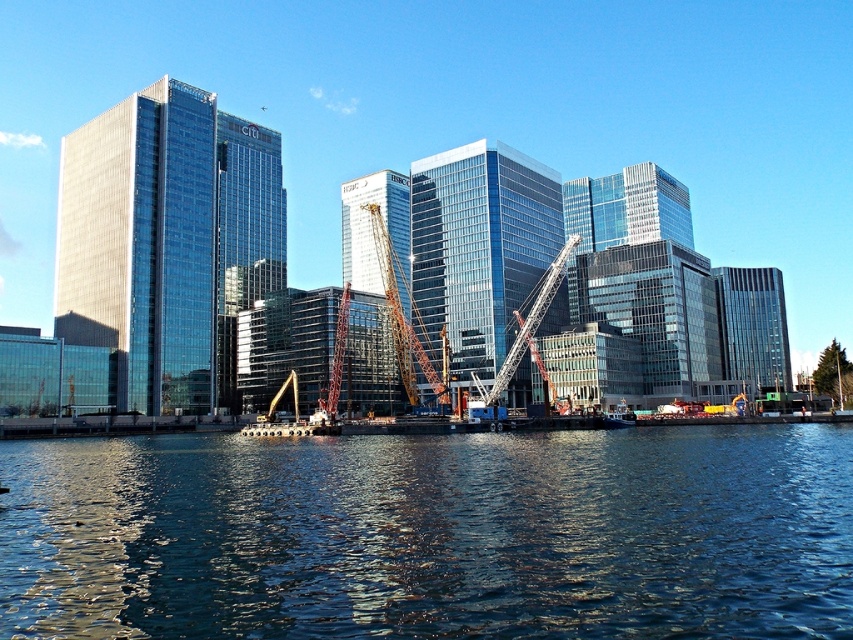
You are an architect reviewing a cityscape design. You notice the shiny glass skyscraper at left and the glassy steel tower at center. Which structure is positioned lower in the scene?

The shiny glass skyscraper at left is located below the glassy steel tower at center, so it is positioned lower in the scene.

You are a photographer wanting to capture the dark blue water at lower center and the glassy reflective skyscraper at center in a single shot. Which object will appear taller in the photo?

The glassy reflective skyscraper at center appears taller in the photo because it has a greater height than the dark blue water at lower center.